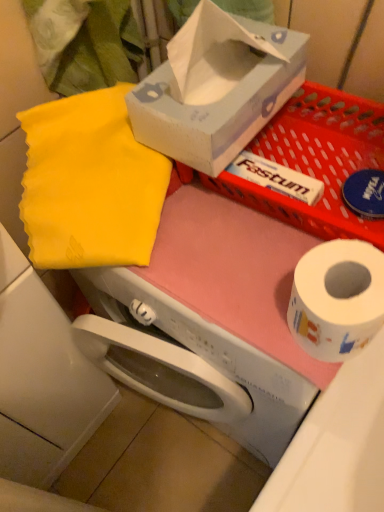
Question: Is yellow fabric at upper left surrounding matte white tissue box at upper center?

Choices:
 (A) yes
 (B) no

Answer: (B)

Question: Is yellow fabric at upper left in front of matte white tissue box at upper center?

Choices:
 (A) yes
 (B) no

Answer: (B)

Question: Considering the relative positions of yellow fabric at upper left and matte white tissue box at upper center in the image provided, is yellow fabric at upper left behind matte white tissue box at upper center?

Choices:
 (A) no
 (B) yes

Answer: (B)

Question: Can you confirm if yellow fabric at upper left is bigger than matte white tissue box at upper center?

Choices:
 (A) yes
 (B) no

Answer: (A)

Question: Would you consider yellow fabric at upper left to be distant from matte white tissue box at upper center?

Choices:
 (A) no
 (B) yes

Answer: (A)

Question: Is yellow fabric at upper left outside of matte white tissue box at upper center?

Choices:
 (A) yes
 (B) no

Answer: (A)

Question: Is white paper at right taller than matte white tissue box at upper center?

Choices:
 (A) yes
 (B) no

Answer: (B)

Question: From the image's perspective, would you say white paper at right is shown under matte white tissue box at upper center?

Choices:
 (A) yes
 (B) no

Answer: (A)

Question: Considering the relative positions of white paper at right and matte white tissue box at upper center in the image provided, is white paper at right to the right of matte white tissue box at upper center from the viewer's perspective?

Choices:
 (A) yes
 (B) no

Answer: (A)

Question: Considering the relative sizes of white paper at right and matte white tissue box at upper center in the image provided, is white paper at right thinner than matte white tissue box at upper center?

Choices:
 (A) no
 (B) yes

Answer: (B)

Question: From the image's perspective, is white paper at right on top of matte white tissue box at upper center?

Choices:
 (A) no
 (B) yes

Answer: (A)

Question: Is white paper at right positioned behind matte white tissue box at upper center?

Choices:
 (A) yes
 (B) no

Answer: (B)

Question: Considering the relative sizes of matte white tissue box at upper center and white paper at right in the image provided, is matte white tissue box at upper center bigger than white paper at right?

Choices:
 (A) yes
 (B) no

Answer: (A)